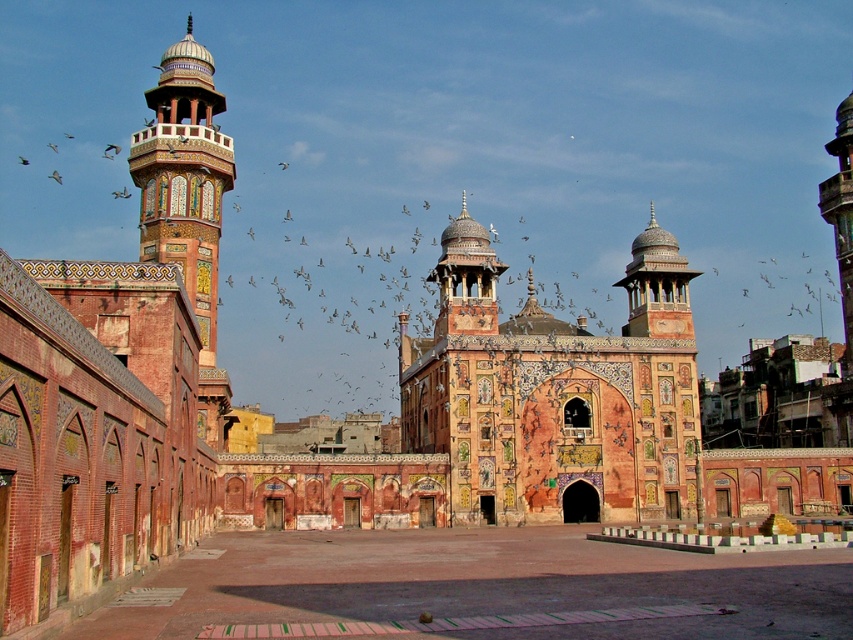
Based on the provided scene description, where is the terracotta mosaic palace at center located in the image?

The terracotta mosaic palace at center is located at point 0.614 on the x axis and 0.652 on the y axis.

You are standing in the courtyard of the mosque and want to take a photo of both the terracotta mosaic palace at center and the decorative mosaic minaret at left. Which object should you position closer to the camera to ensure both are in focus?

You should position the decorative mosaic minaret at left closer to the camera because it is behind the terracotta mosaic palace at center, so bringing it forward will help both be in focus.

You are an architect analyzing the mosque layout. You need to determine the spatial relationship between the terracotta mosaic palace at center and the decorative mosaic minaret at left. Which one has a greater width according to the available information?

The terracotta mosaic palace at center might be wider than decorative mosaic minaret at left according to the description provided.